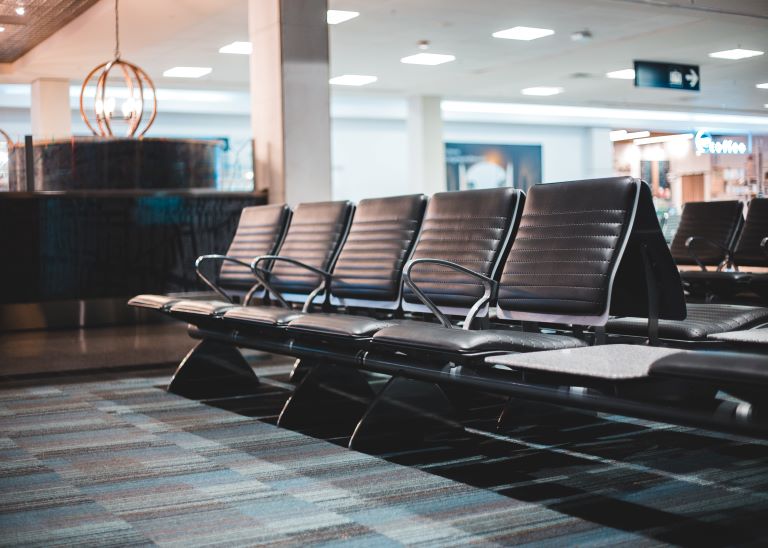
Where is `armrest`? This screenshot has width=768, height=548. armrest is located at coordinates (412, 256).